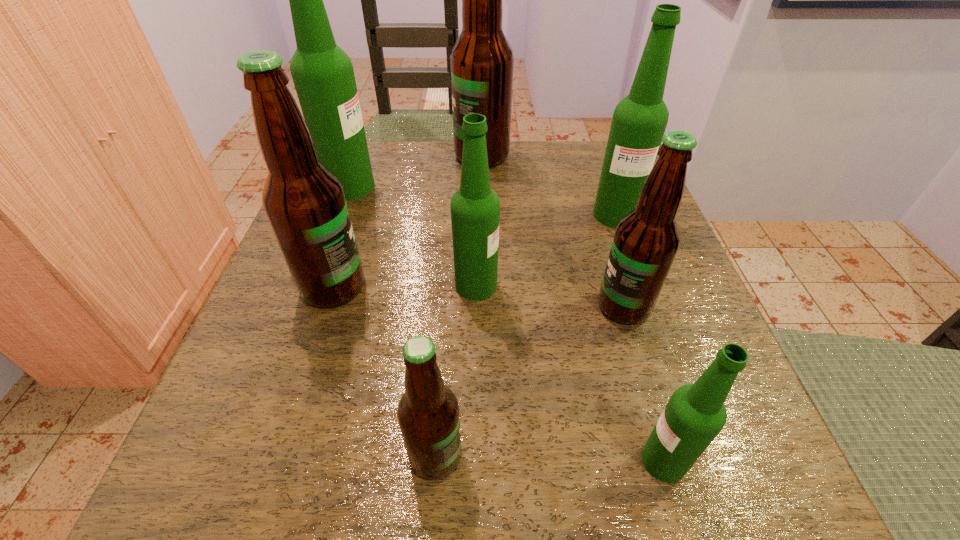
Find the location of a particular element. the farthest brown beer bottle is located at coordinates (482, 61).

Find the location of `the farthest object`. the farthest object is located at coordinates (482, 61).

Identify the location of the leftmost green beer bottle. The width and height of the screenshot is (960, 540). (323, 75).

Identify the location of the farthest green beer bottle. Image resolution: width=960 pixels, height=540 pixels. (323, 75).

The image size is (960, 540). Find the location of `the leftmost brown beer bottle`. the leftmost brown beer bottle is located at coordinates (304, 201).

The width and height of the screenshot is (960, 540). Identify the location of the sixth nearest beer bottle. (639, 121).

The width and height of the screenshot is (960, 540). I want to click on the third nearest green beer bottle, so click(639, 121).

In order to click on the rightmost brown beer bottle in this screenshot , I will do `click(646, 240)`.

Where is `the second nearest green beer bottle`? the second nearest green beer bottle is located at coordinates (475, 208).

This screenshot has width=960, height=540. Find the location of `the third biggest green beer bottle`. the third biggest green beer bottle is located at coordinates (475, 208).